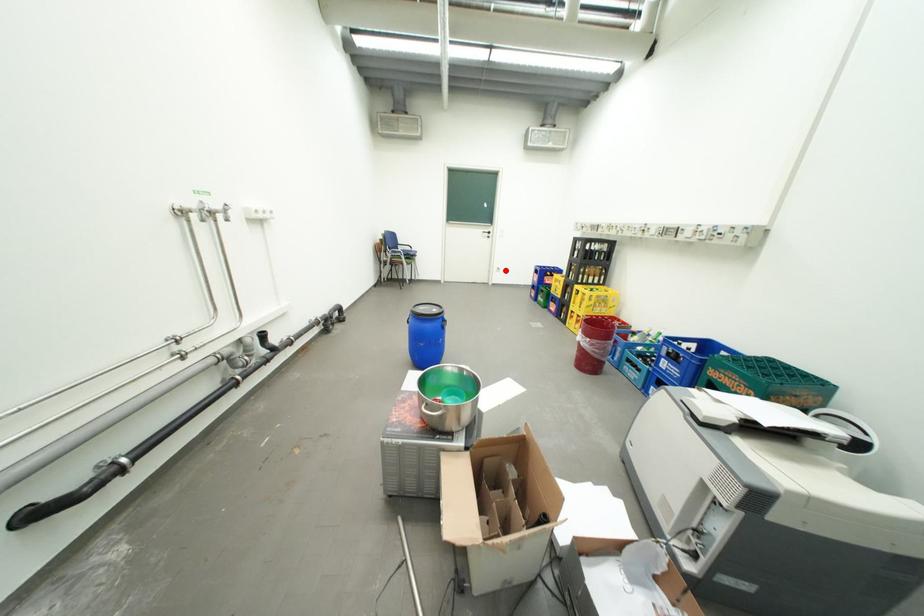
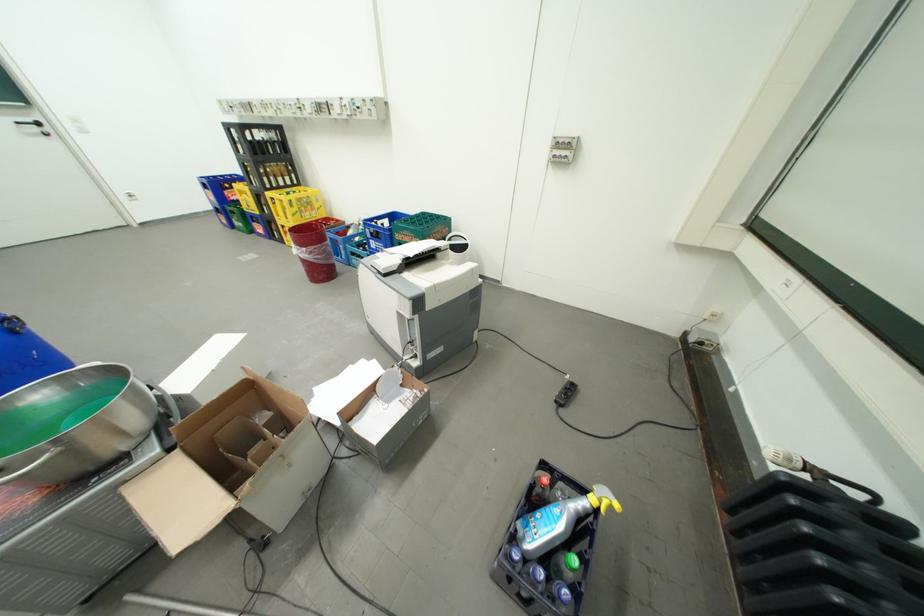
Locate, in the second image, the point that corresponds to the highlighted location in the first image.

(134, 199)